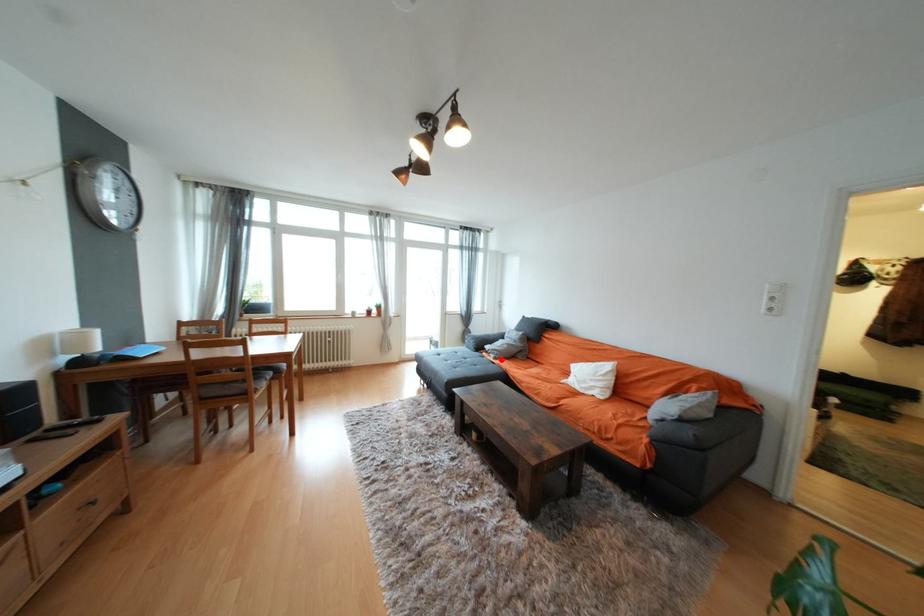
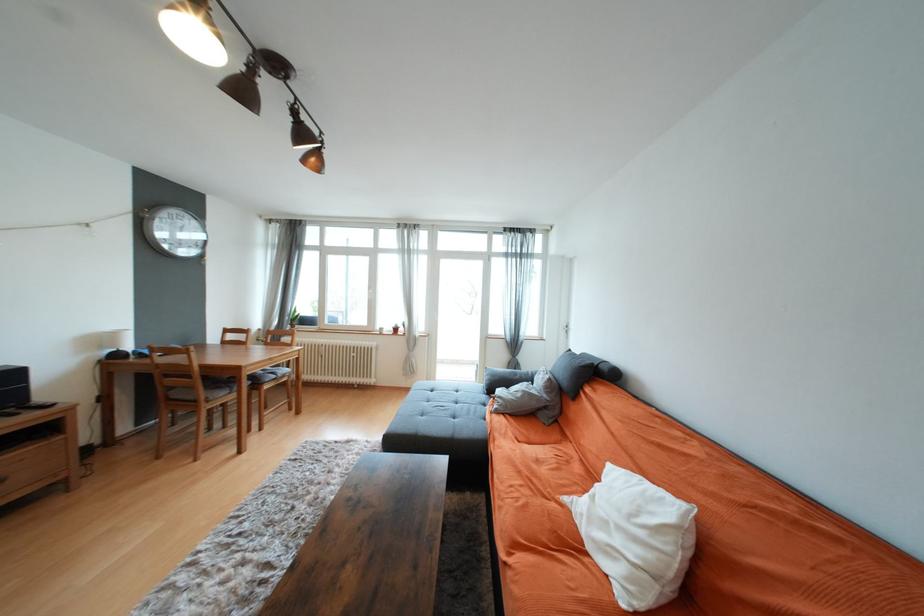
In the second image, find the point that corresponds to the highlighted location in the first image.

(503, 413)